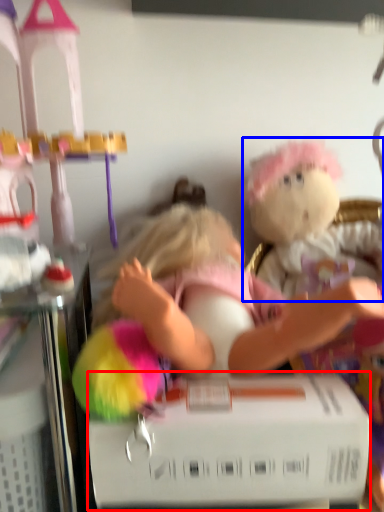
Question: Which of the following is the closest to the observer, box (highlighted by a red box) or toy (highlighted by a blue box)?

Choices:
 (A) box
 (B) toy

Answer: (A)